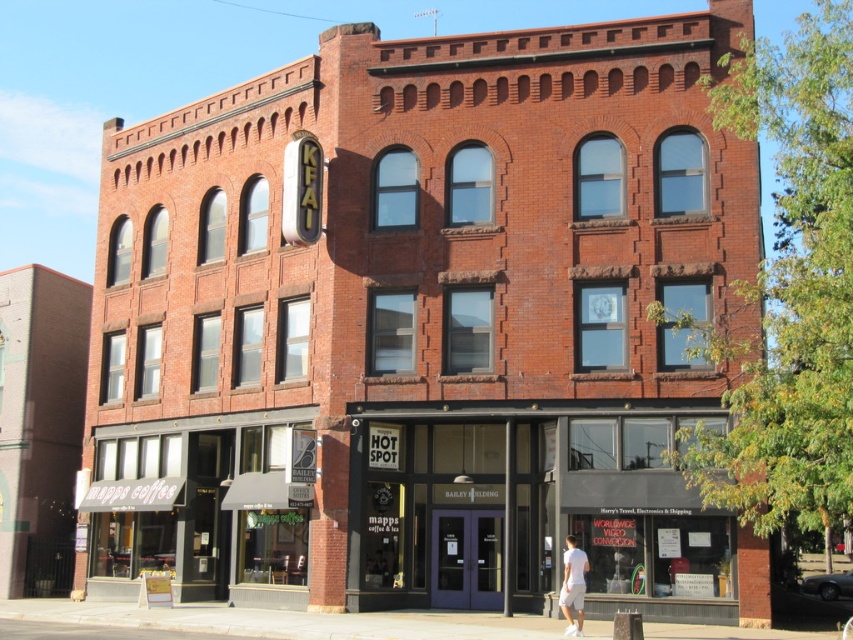
Which is below, matte black storefront at center or white cotton shorts at lower right?

white cotton shorts at lower right

Is matte black storefront at center wider than white cotton shorts at lower right?

Yes.

Describe the element at coordinates (532, 508) in the screenshot. I see `matte black storefront at center` at that location.

Find the location of a particular element. The height and width of the screenshot is (640, 853). matte black storefront at center is located at coordinates (532, 508).